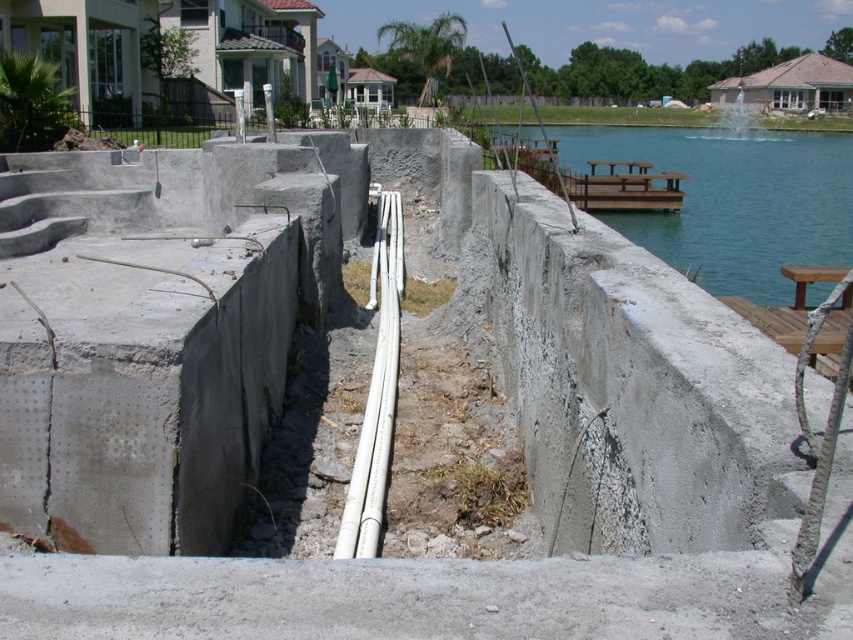
Is point (776, 252) closer to viewer compared to point (817, 276)?

That is False.

What do you see at coordinates (733, 202) in the screenshot?
I see `blue water at upper right` at bounding box center [733, 202].

Is point (759, 260) positioned before point (851, 288)?

No, it is behind (851, 288).

In order to click on blue water at upper right in this screenshot , I will do `click(733, 202)`.

Between blue water at upper right and brown wooden dock at center, which one has more height?

With more height is blue water at upper right.

Who is positioned more to the left, blue water at upper right or brown wooden dock at center?

brown wooden dock at center

Is point (619, 156) closer to viewer compared to point (677, 189)?

No, (619, 156) is further to viewer.

I want to click on blue water at upper right, so click(x=733, y=202).

Between white plastic pipes at center and brown wooden dock at right, which one has less height?

brown wooden dock at right

Is point (399, 264) positioned after point (846, 296)?

Yes, it is.

This screenshot has width=853, height=640. I want to click on white plastic pipes at center, so click(x=376, y=390).